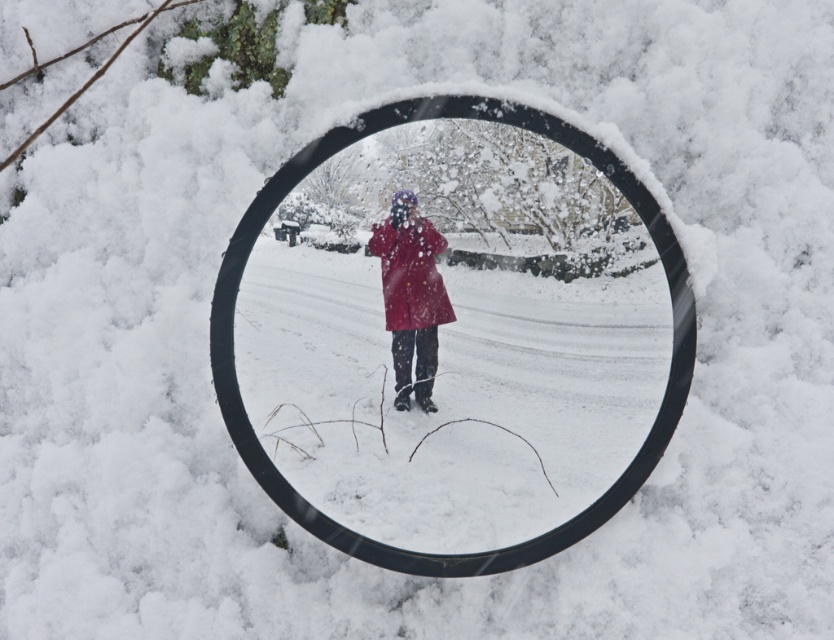
Question: Which of the following is the farthest from the observer?

Choices:
 (A) black plastic magnifying glass at center
 (B) matte red coat at center

Answer: (A)

Question: Is black plastic magnifying glass at center to the left of matte red coat at center from the viewer's perspective?

Choices:
 (A) no
 (B) yes

Answer: (A)

Question: Can you confirm if black plastic magnifying glass at center is positioned to the left of matte red coat at center?

Choices:
 (A) yes
 (B) no

Answer: (B)

Question: Which object appears closest to the camera in this image?

Choices:
 (A) matte red coat at center
 (B) black plastic magnifying glass at center

Answer: (A)

Question: Can you confirm if black plastic magnifying glass at center is positioned above matte red coat at center?

Choices:
 (A) yes
 (B) no

Answer: (B)

Question: Among these objects, which one is nearest to the camera?

Choices:
 (A) black plastic magnifying glass at center
 (B) matte red coat at center

Answer: (B)